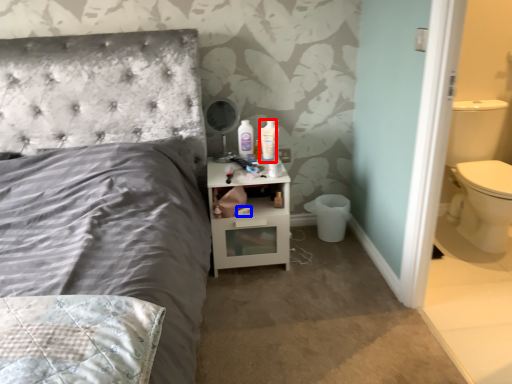
Question: Among these objects, which one is farthest to the camera, mouthwash (highlighted by a red box) or toilet paper (highlighted by a blue box)?

Choices:
 (A) mouthwash
 (B) toilet paper

Answer: (A)